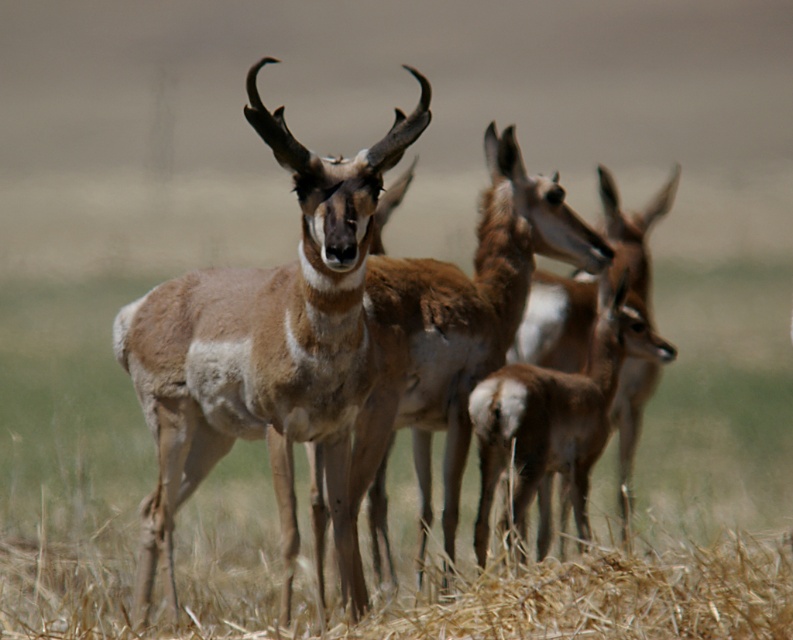
Is brown fur antelope at center bigger than brown furry deer at center?

Correct, brown fur antelope at center is larger in size than brown furry deer at center.

You are a GUI agent. You are given a task and a screenshot of the screen. Output one action in this format:
    pyautogui.click(x=<x>, y=<y>)
    Task: Click on the brown fur antelope at center
    The image size is (793, 640).
    Given the screenshot: What is the action you would take?
    pyautogui.click(x=263, y=348)